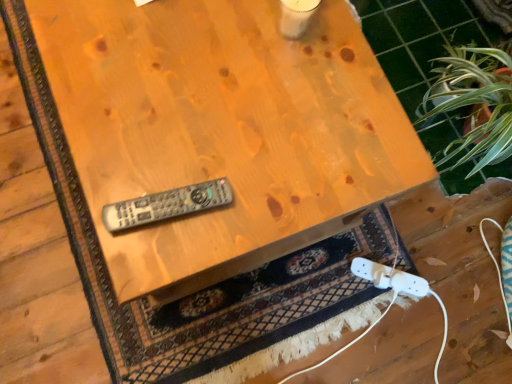
The width and height of the screenshot is (512, 384). I want to click on vacant area that lies between wooden remote control at center and white plastic game controller at lower right, so click(x=313, y=274).